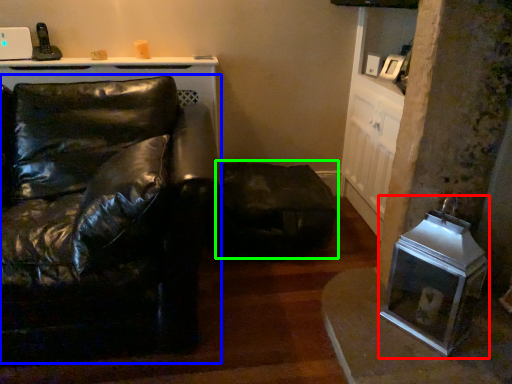
Question: Considering the real-world distances, which object is farthest from appliance (highlighted by a red box)? studio couch (highlighted by a blue box) or swivel chair (highlighted by a green box)?

Choices:
 (A) studio couch
 (B) swivel chair

Answer: (A)